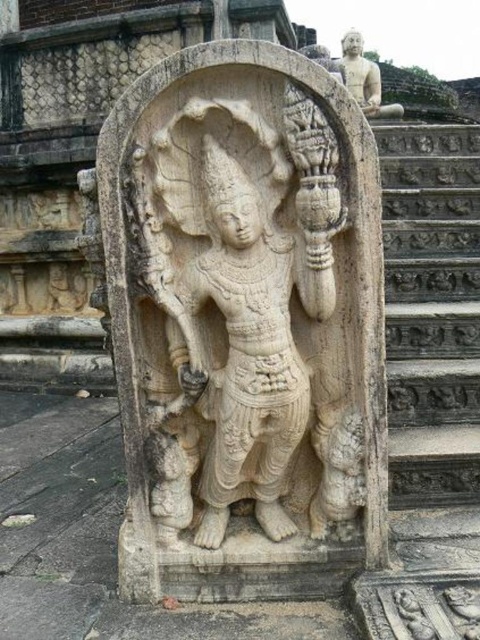
You are an art conservator examining the stone relief sculpture. You need to determine if the white stone statue at center can be moved to the gray stone stairs at right without needing to adjust its size. Based on the description, what should you consider?

The white stone statue at center is smaller than the gray stone stairs at right, so it can be moved there without needing to adjust its size.

You are an art conservator examining the stone relief sculpture. You notice two points of concern marked at coordinates point [132,541] and point [421,307]. If you were to clean these points starting from the front of the sculpture, which point should you address first?

Point [132,541] is in front of point [421,307], so you should clean point [132,541] first since it is closer to the viewer.

Based on the scene description, where is the white stone statue at center located in terms of its coordinates?

The white stone statue at center is located at coordinates approximately 0.508 on the x axis and 0.510 on the y axis.